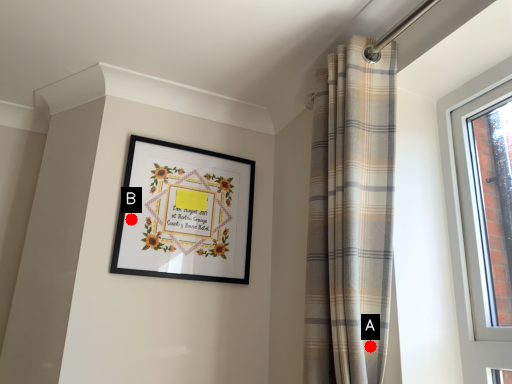
Question: Two points are circled on the image, labeled by A and B beside each circle. Which of the following is the closest to the observer?

Choices:
 (A) A is closer
 (B) B is closer

Answer: (A)